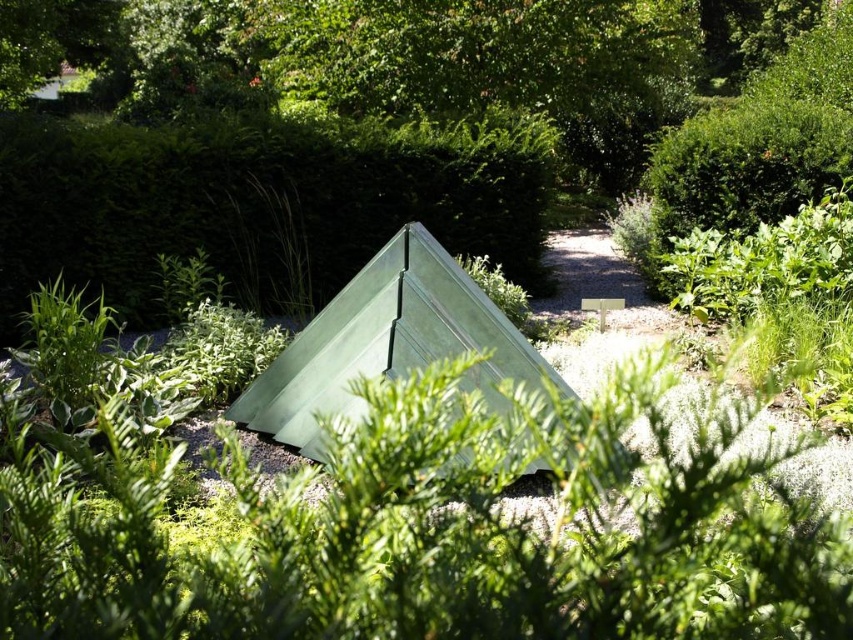
Question: Which of the following is the farthest from the observer?

Choices:
 (A) (268, 381)
 (B) (184, 202)

Answer: (B)

Question: Does green matte tent at center come behind green fabric tent at center?

Choices:
 (A) yes
 (B) no

Answer: (A)

Question: Does green matte tent at center appear on the left side of green fabric tent at center?

Choices:
 (A) no
 (B) yes

Answer: (B)

Question: Is green matte tent at center behind green fabric tent at center?

Choices:
 (A) no
 (B) yes

Answer: (B)